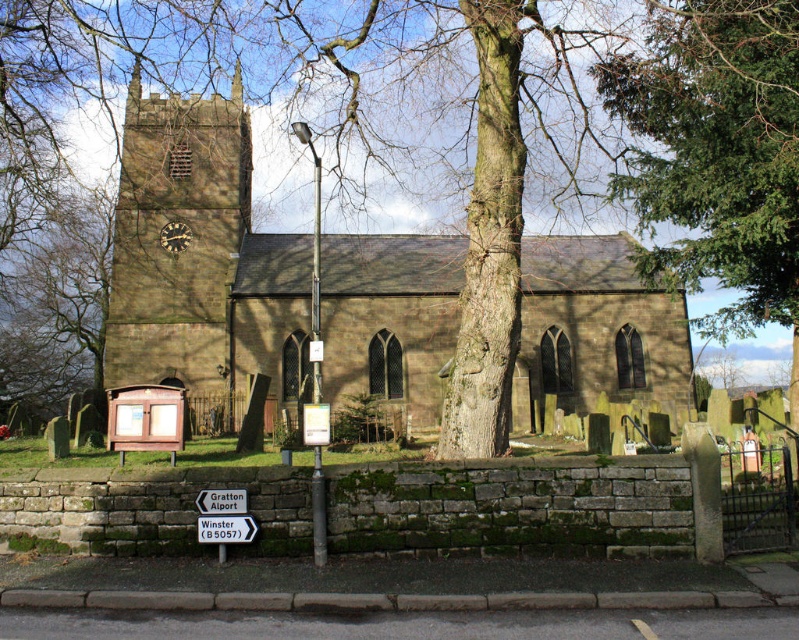
Which is more to the left, green coniferous tree at upper right or brown stone clock tower at center-left?

brown stone clock tower at center-left is more to the left.

Is point (753, 323) closer to camera compared to point (114, 253)?

Yes, point (753, 323) is closer to viewer.

Who is more forward, (674, 257) or (233, 419)?

Point (674, 257)

Image resolution: width=799 pixels, height=640 pixels. I want to click on green coniferous tree at upper right, so click(x=718, y=150).

Does brown stone church at center have a greater width compared to white plastic sign at lower center?

Yes, brown stone church at center is wider than white plastic sign at lower center.

Does brown stone church at center appear on the right side of white plastic sign at lower center?

Incorrect, brown stone church at center is not on the right side of white plastic sign at lower center.

The image size is (799, 640). In order to click on brown stone church at center in this screenshot , I will do `click(201, 257)`.

Between brown stone church at center and green coniferous tree at upper right, which one has less height?

green coniferous tree at upper right is shorter.

Does brown stone church at center have a larger size compared to green coniferous tree at upper right?

Correct, brown stone church at center is larger in size than green coniferous tree at upper right.

The image size is (799, 640). In order to click on brown stone church at center in this screenshot , I will do `click(201, 257)`.

This screenshot has height=640, width=799. I want to click on brown stone church at center, so click(x=201, y=257).